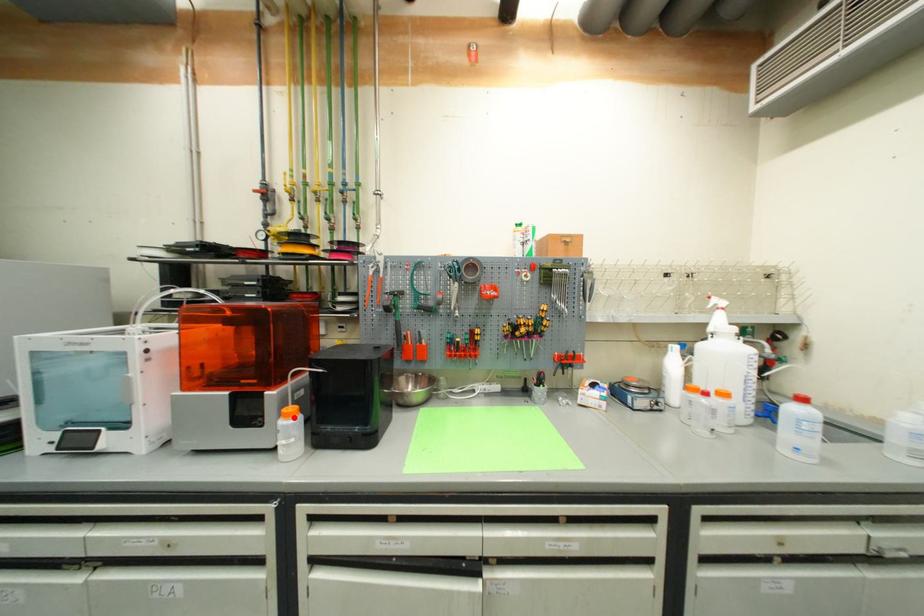
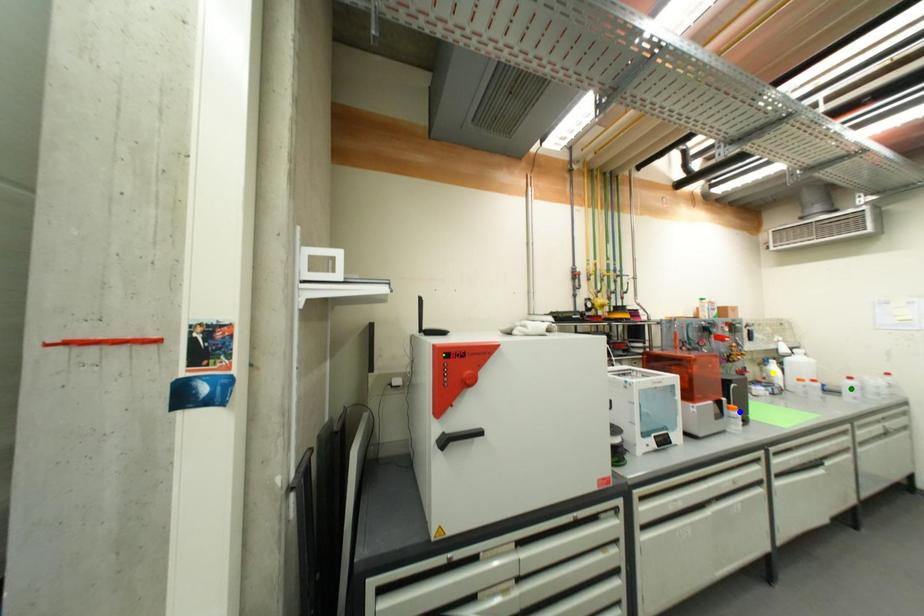
Question: I am providing you with two images of the same scene from different viewpoints. A red point is marked on the first image. You are given multiple points on the second image. Can you choose the point in image 2 that corresponds to the point in image 1?

Choices:
 (A) green point
 (B) blue point
 (C) yellow point

Answer: (B)